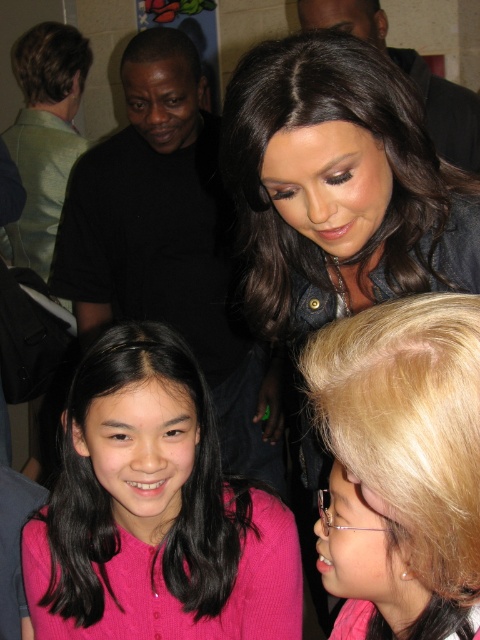
You are a photographer trying to capture a closeup of the shiny black hair at center and the pink knitted sweater at center. Which object should you zoom in on first to ensure it fills the frame properly?

The shiny black hair at center is larger in size than the pink knitted sweater at center, so you should zoom in on the shiny black hair at center first to ensure it fills the frame properly.

You are a photographer trying to capture a closeup shot of the young girl in the scene. You notice both the shiny black hair at center and the pink knitted sweater at center. Which object should you focus on if you want to ensure the subject with the larger width is in the frame?

The pink knitted sweater at center has a larger width than the shiny black hair at center, so focusing on the pink knitted sweater at center will ensure the larger object is in the frame.

In the image, there is a point at coordinates (338,186). Based on the scene description, where is this point located?

The point at (338,186) is located on the shiny black hair at center.